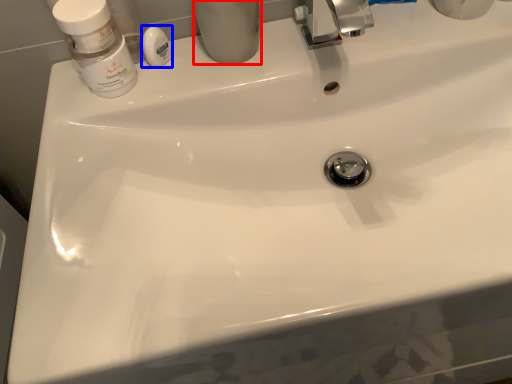
Question: Which object is further to the camera taking this photo, toiletry (highlighted by a red box) or soap (highlighted by a blue box)?

Choices:
 (A) toiletry
 (B) soap

Answer: (B)